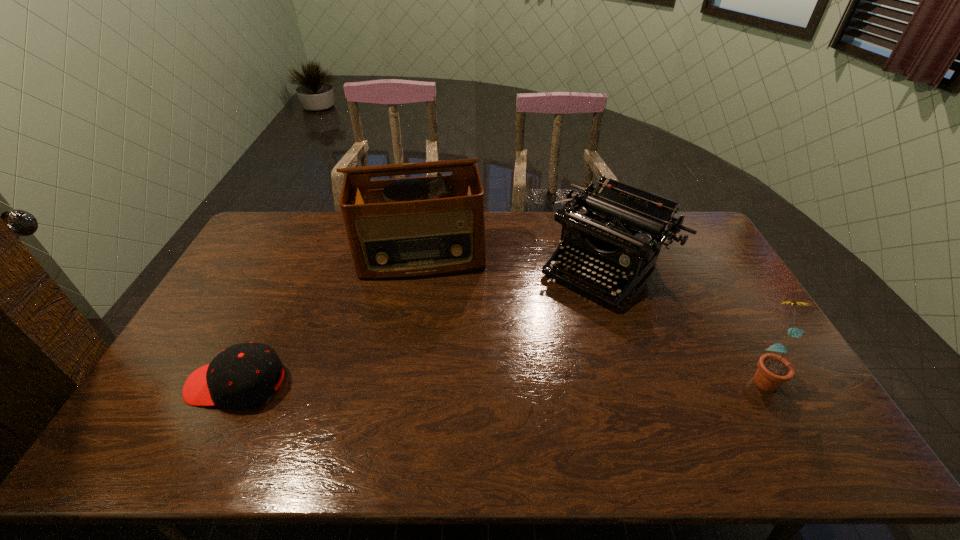
You are a GUI agent. You are given a task and a screenshot of the screen. Output one action in this format:
    pyautogui.click(x=<x>, y=<y>)
    Task: Click on the vacant space located 0.200m on the front panel of the third object from right to left
    This screenshot has width=960, height=540.
    Given the screenshot: What is the action you would take?
    pyautogui.click(x=429, y=325)

Locate an element on the screen. The image size is (960, 540). vacant position located 0.130m on the front panel of the third object from right to left is located at coordinates (428, 308).

Where is `free region located on the front panel of the third object from right to left`? free region located on the front panel of the third object from right to left is located at coordinates (432, 357).

Identify the location of typewriter that is at the far edge. (621, 228).

In order to click on radio receiver located in the far edge section of the desktop in this screenshot , I will do `click(422, 226)`.

Image resolution: width=960 pixels, height=540 pixels. In order to click on cap that is at the near edge in this screenshot , I will do `click(243, 375)`.

Find the location of a particular element. Image resolution: width=960 pixels, height=540 pixels. sunflower that is at the near edge is located at coordinates (773, 370).

Find the location of a particular element. The height and width of the screenshot is (540, 960). object that is at the left edge is located at coordinates point(243,375).

Identify the location of object present at the right edge. The width and height of the screenshot is (960, 540). (773, 370).

Image resolution: width=960 pixels, height=540 pixels. Identify the location of object located in the near left corner section of the desktop. (243, 375).